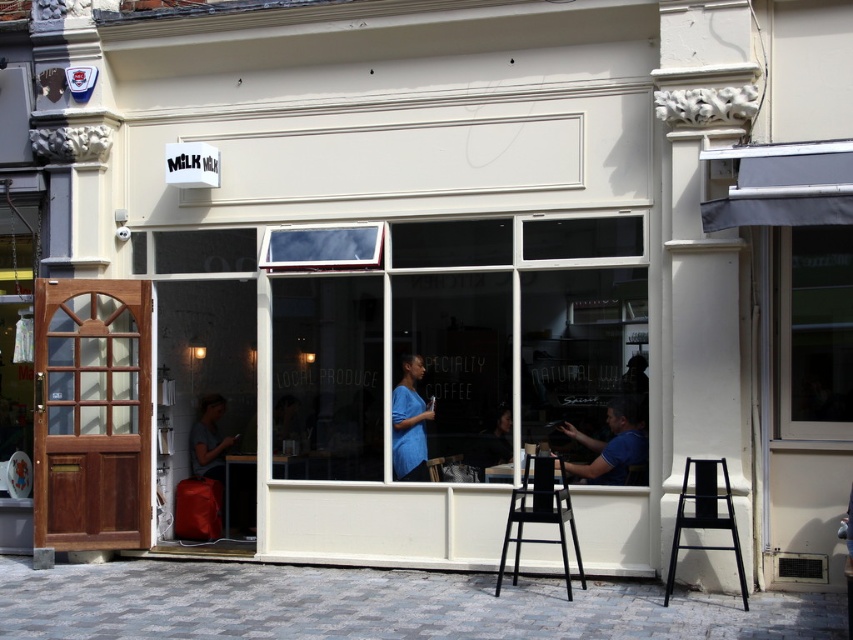
Is point (815, 353) positioned after point (215, 445)?

No.

Looking at this image, does transparent glass window at center come in front of matte red bag at lower left?

Yes, it is in front of matte red bag at lower left.

Which is behind, point (795, 340) or point (190, 461)?

The point (190, 461) is more distant.

In order to click on transparent glass window at center in this screenshot , I will do [x=813, y=332].

Which is above, black plastic bar stool at center or black matte bar stool at lower right?

black matte bar stool at lower right

Does black plastic bar stool at center have a smaller size compared to black matte bar stool at lower right?

Incorrect, black plastic bar stool at center is not smaller in size than black matte bar stool at lower right.

Is point (502, 545) in front of point (741, 572)?

No, (502, 545) is behind (741, 572).

Locate an element on the screen. The image size is (853, 640). black plastic bar stool at center is located at coordinates (540, 515).

You are a GUI agent. You are given a task and a screenshot of the screen. Output one action in this format:
    pyautogui.click(x=<x>, y=<y>)
    Task: Click on the transparent glass window at center
    The width and height of the screenshot is (853, 640).
    Given the screenshot: What is the action you would take?
    pyautogui.click(x=813, y=332)

Is transparent glass window at center positioned at the back of black plastic bar stool at center?

That is True.

Who is more forward, (799, 387) or (549, 458)?

Point (549, 458)

Image resolution: width=853 pixels, height=640 pixels. Identify the location of transparent glass window at center. coord(813,332).